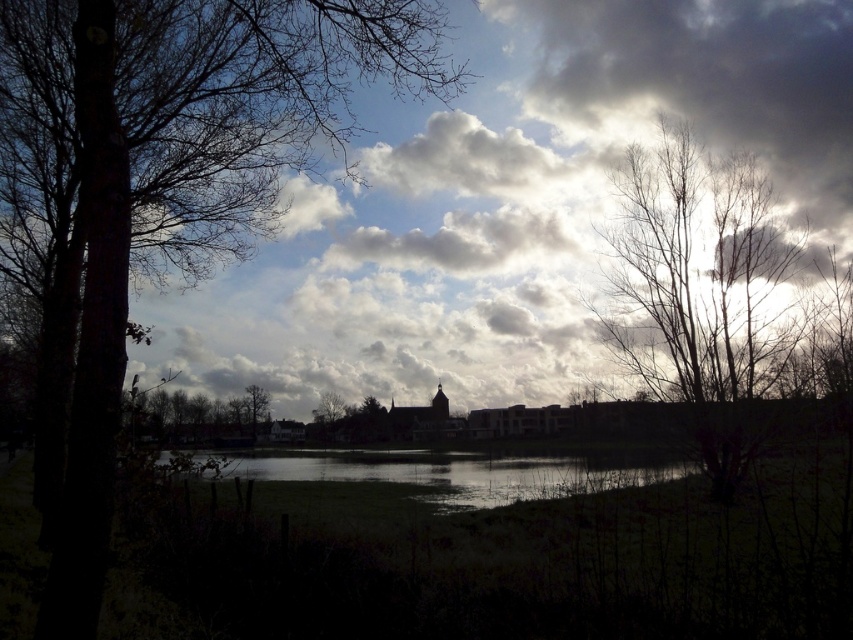
Can you confirm if brown rough bark tree at left is positioned below dark brown bark tree at center?

No, brown rough bark tree at left is not below dark brown bark tree at center.

Between brown rough bark tree at left and dark brown bark tree at center, which one has less height?

dark brown bark tree at center

Locate an element on the screen. brown rough bark tree at left is located at coordinates (172, 157).

Is point (287, 237) less distant than point (370, 465)?

Yes, point (287, 237) is in front of point (370, 465).

Does cloudy sky at upper center appear over dark reflective water at center?

Indeed, cloudy sky at upper center is positioned over dark reflective water at center.

Is point (373, 237) more distant than point (250, 467)?

No, (373, 237) is in front of (250, 467).

Find the location of `cloudy sky at upper center`. cloudy sky at upper center is located at coordinates (511, 202).

What do you see at coordinates (172, 157) in the screenshot?
I see `brown rough bark tree at left` at bounding box center [172, 157].

Who is positioned more to the left, brown rough bark tree at left or bare branches at center?

brown rough bark tree at left

This screenshot has width=853, height=640. Identify the location of brown rough bark tree at left. (172, 157).